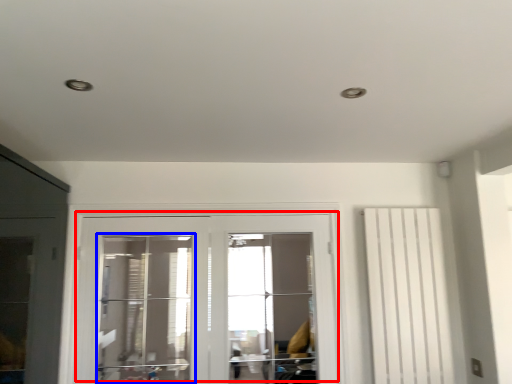
Question: Which object is further to the camera taking this photo, door (highlighted by a red box) or window (highlighted by a blue box)?

Choices:
 (A) door
 (B) window

Answer: (B)